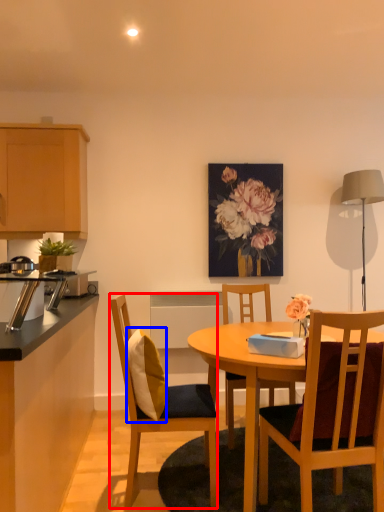
Question: Among these objects, which one is nearest to the camera, chair (highlighted by a red box) or pillow (highlighted by a blue box)?

Choices:
 (A) chair
 (B) pillow

Answer: (B)